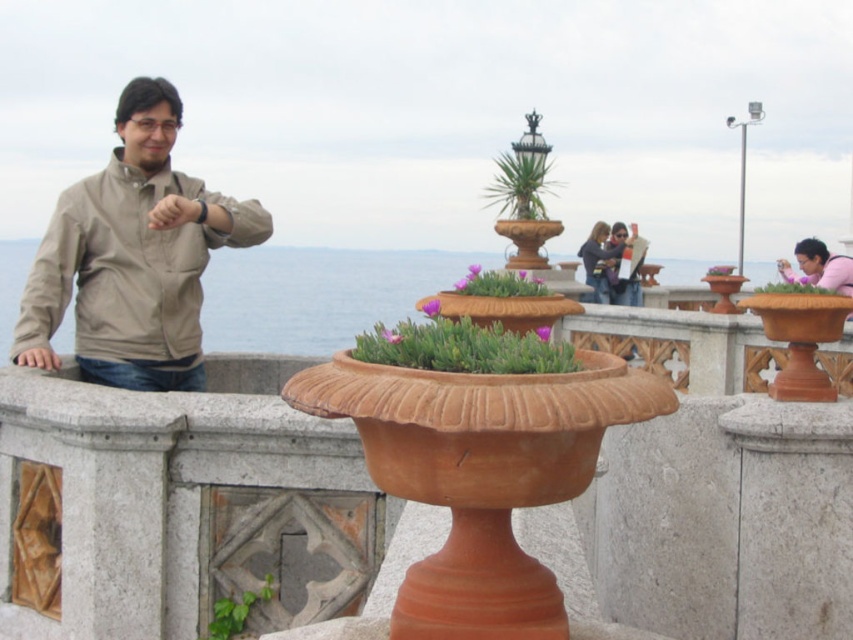
Is point (535, 278) more distant than point (828, 291)?

Yes, it is.

Between purple succulent at center and green leafy plant at center, which one is positioned higher?

purple succulent at center is above.

Who is more distant from viewer, (x=529, y=292) or (x=759, y=291)?

Point (x=759, y=291)

This screenshot has width=853, height=640. In order to click on purple succulent at center in this screenshot , I will do `click(498, 284)`.

Is terracotta textured planter at center thinner than green leafy plant at lower left?

No, terracotta textured planter at center is not thinner than green leafy plant at lower left.

Between terracotta textured planter at center and green leafy plant at lower left, which one is positioned higher?

terracotta textured planter at center

You are a GUI agent. You are given a task and a screenshot of the screen. Output one action in this format:
    pyautogui.click(x=<x>, y=<y>)
    Task: Click on the terracotta textured planter at center
    The image size is (853, 640).
    Given the screenshot: What is the action you would take?
    pyautogui.click(x=466, y=344)

From the picture: Does green leafy plant at upper center have a lesser height compared to purple succulent at center?

In fact, green leafy plant at upper center may be taller than purple succulent at center.

This screenshot has width=853, height=640. I want to click on green leafy plant at upper center, so [x=520, y=182].

Where is `green leafy plant at upper center`? green leafy plant at upper center is located at coordinates (520, 182).